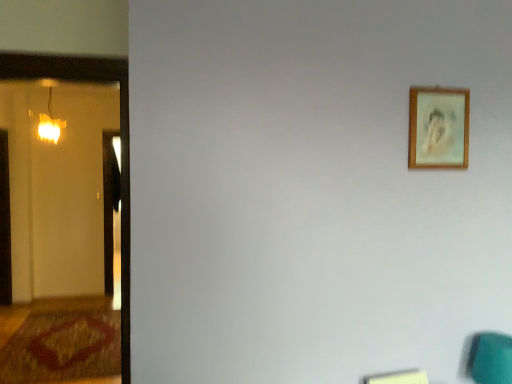
Question: Is wooden picture frame at upper right facing away from brown textured rug at lower left?

Choices:
 (A) no
 (B) yes

Answer: (A)

Question: Are wooden picture frame at upper right and brown textured rug at lower left far apart?

Choices:
 (A) yes
 (B) no

Answer: (A)

Question: Is the surface of wooden picture frame at upper right in direct contact with brown textured rug at lower left?

Choices:
 (A) yes
 (B) no

Answer: (B)

Question: Can you confirm if wooden picture frame at upper right is taller than brown textured rug at lower left?

Choices:
 (A) yes
 (B) no

Answer: (A)

Question: Considering the relative sizes of wooden picture frame at upper right and brown textured rug at lower left in the image provided, is wooden picture frame at upper right wider than brown textured rug at lower left?

Choices:
 (A) yes
 (B) no

Answer: (B)

Question: Can you confirm if wooden picture frame at upper right is positioned to the right of brown textured rug at lower left?

Choices:
 (A) no
 (B) yes

Answer: (B)

Question: From a real-world perspective, is matte glass lamp at left positioned under wooden picture frame at upper right based on gravity?

Choices:
 (A) yes
 (B) no

Answer: (B)

Question: From the image's perspective, is matte glass lamp at left over wooden picture frame at upper right?

Choices:
 (A) no
 (B) yes

Answer: (B)

Question: Are matte glass lamp at left and wooden picture frame at upper right located far from each other?

Choices:
 (A) yes
 (B) no

Answer: (A)

Question: Is matte glass lamp at left smaller than wooden picture frame at upper right?

Choices:
 (A) no
 (B) yes

Answer: (A)

Question: Does matte glass lamp at left turn towards wooden picture frame at upper right?

Choices:
 (A) no
 (B) yes

Answer: (A)

Question: Considering the relative sizes of matte glass lamp at left and wooden picture frame at upper right in the image provided, is matte glass lamp at left taller than wooden picture frame at upper right?

Choices:
 (A) yes
 (B) no

Answer: (A)

Question: Considering the relative sizes of matte glass lamp at left and teal fabric swivel chair at lower right in the image provided, is matte glass lamp at left taller than teal fabric swivel chair at lower right?

Choices:
 (A) yes
 (B) no

Answer: (A)